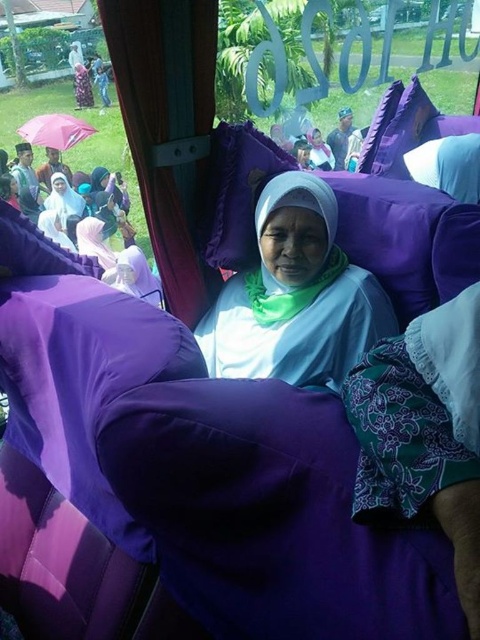
Who is more distant from viewer, (129,88) or (33,136)?

Positioned behind is point (33,136).

Can you confirm if purple fabric curtain at left is positioned above pink fabric umbrella at upper left?

Incorrect, purple fabric curtain at left is not positioned above pink fabric umbrella at upper left.

Who is more forward, (200, 275) or (60, 140)?

Point (200, 275) is more forward.

I want to click on purple fabric curtain at left, so pyautogui.click(x=168, y=128).

In the scene shown: Can you confirm if matte white hijab at center is positioned below pink fabric umbrella at upper left?

Yes, matte white hijab at center is below pink fabric umbrella at upper left.

Which is in front, point (243, 352) or point (80, 118)?

Point (243, 352) is more forward.

Is point (267, 324) positioned behind point (67, 116)?

No, (267, 324) is in front of (67, 116).

At what (x,y) coordinates should I click in order to perform the action: click on matte white hijab at center. Please return your answer as a coordinate pair (x, y). Looking at the image, I should click on (296, 296).

Does pink fabric umbrella at upper left have a lesser width compared to matte purple hijab at center?

In fact, pink fabric umbrella at upper left might be wider than matte purple hijab at center.

Does pink fabric umbrella at upper left have a larger size compared to matte purple hijab at center?

Correct, pink fabric umbrella at upper left is larger in size than matte purple hijab at center.

The image size is (480, 640). In order to click on pink fabric umbrella at upper left in this screenshot , I will do `click(56, 131)`.